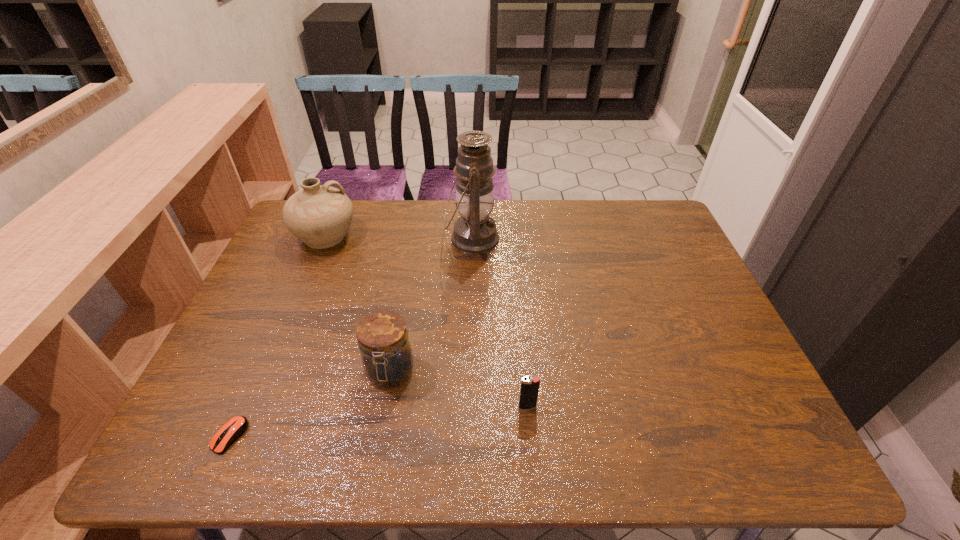
The width and height of the screenshot is (960, 540). I want to click on the second object from right to left, so click(x=475, y=232).

Where is `the tallest object`? The image size is (960, 540). the tallest object is located at coordinates (475, 232).

The width and height of the screenshot is (960, 540). What are the coordinates of `pottery` in the screenshot? It's located at (319, 215).

Locate an element on the screen. the third object from right to left is located at coordinates 386,354.

This screenshot has height=540, width=960. In order to click on the third farthest object in this screenshot , I will do `click(386, 354)`.

What are the coordinates of `the second nearest object` in the screenshot? It's located at (529, 391).

Where is `the fourth tallest object`? This screenshot has height=540, width=960. the fourth tallest object is located at coordinates (529, 391).

Identify the location of computer mouse. The height and width of the screenshot is (540, 960). (235, 427).

I want to click on the shortest object, so point(235,427).

Locate an element on the screen. This screenshot has width=960, height=540. vacant space located on the left of the tallest object is located at coordinates (398, 239).